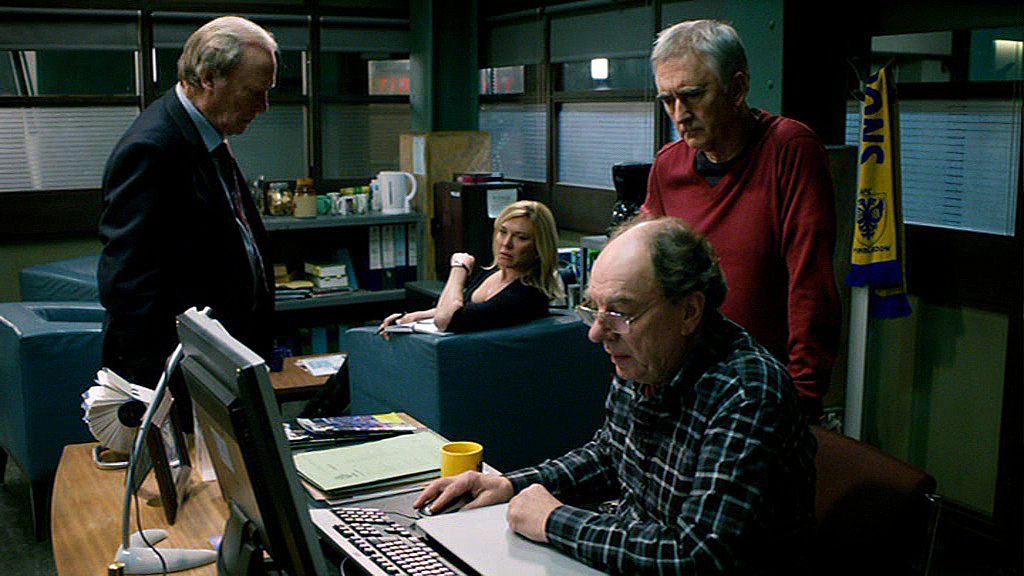
I want to click on keyboard, so click(404, 550).